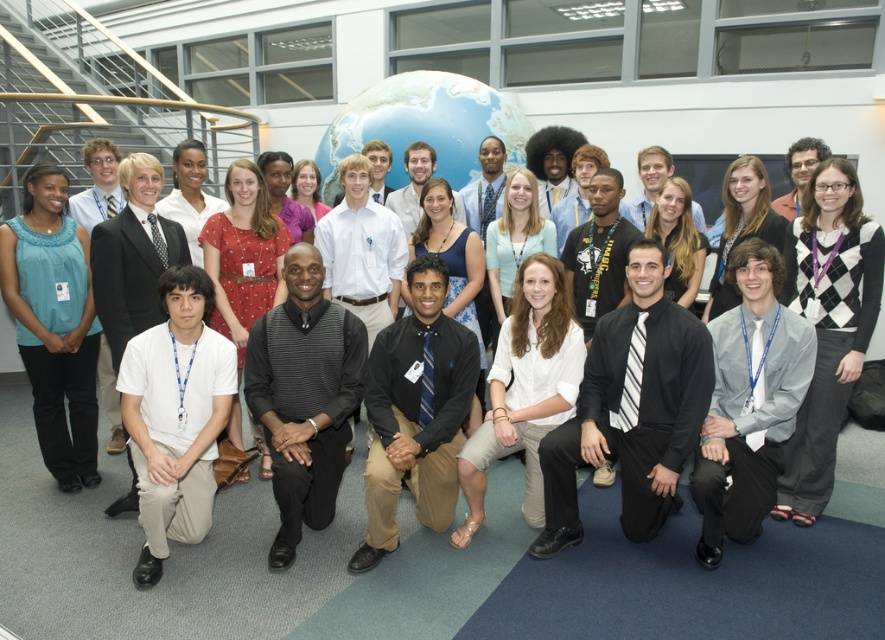
Question: Is black striped sweater at center below white matte shirt at center?

Choices:
 (A) no
 (B) yes

Answer: (A)

Question: Which object appears farthest from the camera in this image?

Choices:
 (A) black striped sweater at center
 (B) gray dress shirt at lower right

Answer: (A)

Question: Which point is farther to the camera?

Choices:
 (A) (150, 570)
 (B) (758, 264)

Answer: (B)

Question: Is black striped sweater at center below white matte shirt at center?

Choices:
 (A) no
 (B) yes

Answer: (A)

Question: Can you confirm if white cotton shirt at lower left is smaller than matte blue blouse at left?

Choices:
 (A) no
 (B) yes

Answer: (B)

Question: Estimate the real-world distances between objects in this image. Which object is closer to the black striped sweater at center?

Choices:
 (A) matte blue blouse at left
 (B) white cotton shirt at lower left

Answer: (B)